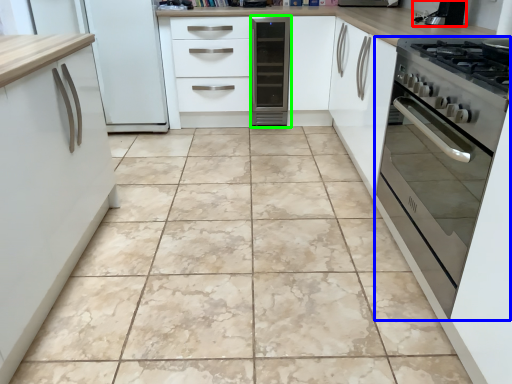
Question: Which object is the closest to the appliance (highlighted by a red box)? Choose among these: oven (highlighted by a blue box) or home appliance (highlighted by a green box).

Choices:
 (A) oven
 (B) home appliance

Answer: (A)